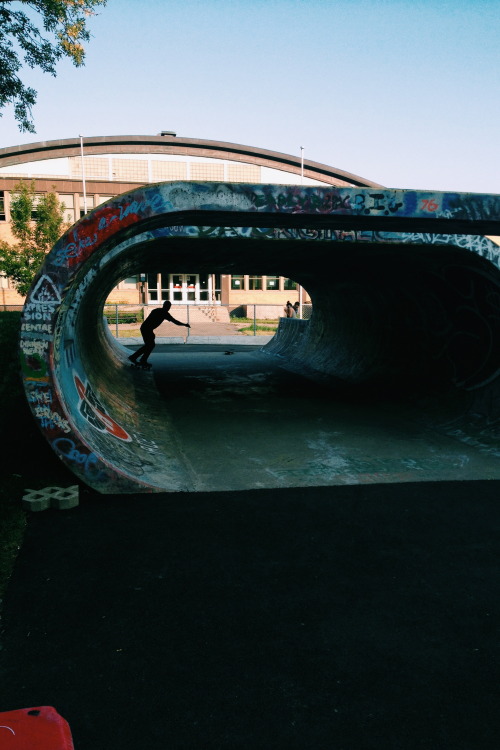
Where is `door`? The width and height of the screenshot is (500, 750). door is located at coordinates (177, 286), (190, 288).